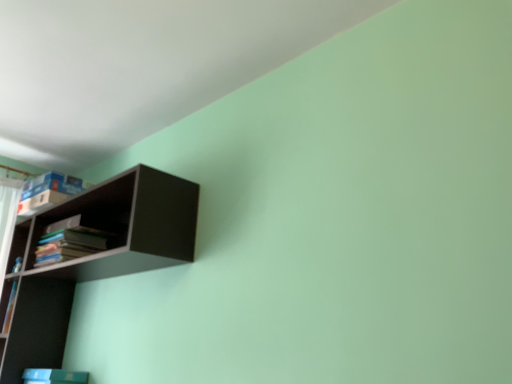
Question: Is matte black shelf at upper left wider than hardcover books at left?

Choices:
 (A) yes
 (B) no

Answer: (A)

Question: From a real-world perspective, is matte black shelf at upper left on top of hardcover books at left?

Choices:
 (A) no
 (B) yes

Answer: (A)

Question: Is hardcover books at left at the back of matte black shelf at upper left?

Choices:
 (A) no
 (B) yes

Answer: (B)

Question: From a real-world perspective, is matte black shelf at upper left physically below hardcover books at left?

Choices:
 (A) no
 (B) yes

Answer: (B)

Question: Is the position of matte black shelf at upper left less distant than that of hardcover books at left?

Choices:
 (A) yes
 (B) no

Answer: (A)

Question: Considering the relative sizes of matte black shelf at upper left and hardcover books at left in the image provided, is matte black shelf at upper left smaller than hardcover books at left?

Choices:
 (A) yes
 (B) no

Answer: (B)

Question: Can you confirm if hardcover books at left is positioned to the left of matte black shelf at upper left?

Choices:
 (A) yes
 (B) no

Answer: (A)

Question: Does hardcover books at left appear on the right side of matte black shelf at upper left?

Choices:
 (A) no
 (B) yes

Answer: (A)

Question: Is the position of hardcover books at left more distant than that of matte black shelf at upper left?

Choices:
 (A) no
 (B) yes

Answer: (B)

Question: Is hardcover books at left oriented towards matte black shelf at upper left?

Choices:
 (A) yes
 (B) no

Answer: (A)

Question: Is hardcover books at left directly adjacent to matte black shelf at upper left?

Choices:
 (A) yes
 (B) no

Answer: (B)

Question: Considering the relative positions of hardcover books at left and matte black shelf at upper left in the image provided, is hardcover books at left in front of matte black shelf at upper left?

Choices:
 (A) yes
 (B) no

Answer: (B)

Question: From the image's perspective, is matte black shelf at upper left positioned above or below hardcover books at left?

Choices:
 (A) below
 (B) above

Answer: (A)